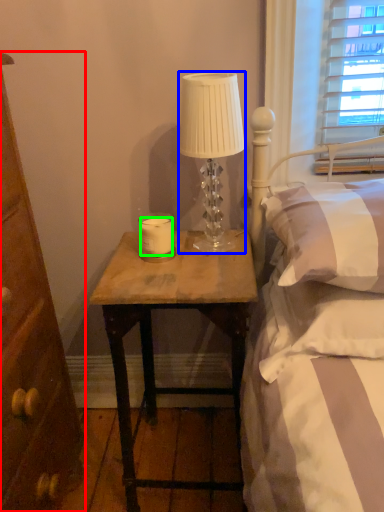
Question: Based on their relative distances, which object is farther from cabinetry (highlighted by a red box)? Choose from lamp (highlighted by a blue box) and candle (highlighted by a green box).

Choices:
 (A) lamp
 (B) candle

Answer: (A)